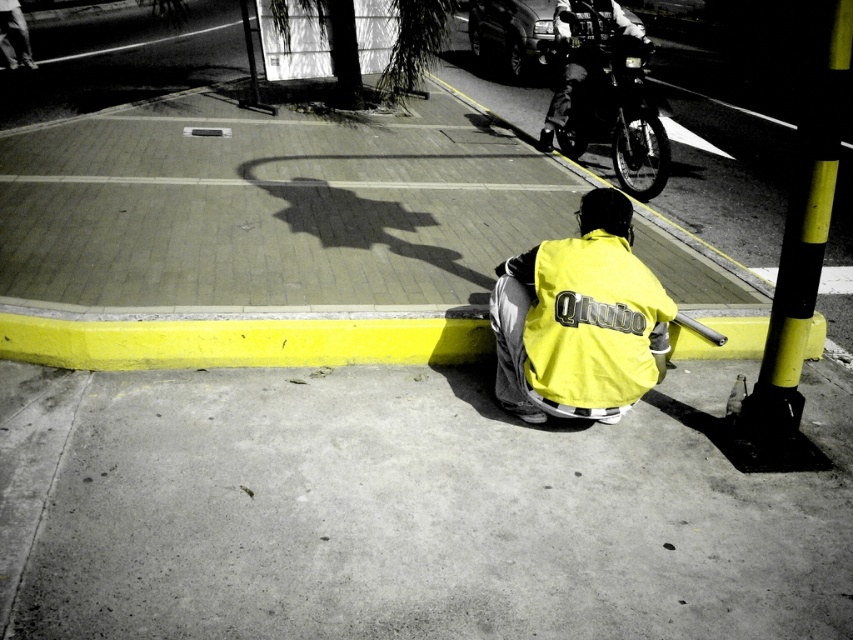
You are a pedestrian crossing the street and see the gray concrete pavement at lower center and the yellow matte safety vest at lower center. Which object is closer to the left edge of the road?

The gray concrete pavement at lower center is positioned on the left side of yellow matte safety vest at lower center, so it is closer to the left edge of the road.

You are a delivery driver who needs to park your vehicle on the street. The parking regulations state that vehicles must be parked at least 1 meter away from any object taller than the curb. Based on the scene, can you park closer to the yellow painted curb at lower center than the yellow matte safety vest at lower center?

The yellow painted curb at lower center has a lesser height compared to the yellow matte safety vest at lower center. Since the safety vest is taller than the curb, you must park at least 1 meter away from it. However, the curb itself is shorter, so you can park closer to the yellow painted curb at lower center as long as you maintain the required distance from the taller safety vest.

You are a delivery robot navigating a narrow path at night. You must pass between the gray concrete pavement at lower center and the yellow matte safety vest at lower center. Can your 1.2 meter wide base fit through the space between them?

The gray concrete pavement at lower center is wider than the yellow matte safety vest at lower center. Since the pavement is wider, the space between them may accommodate the robot. However, the exact width isnanot provided, so it is uncertain if the 1.2 meter width will fit. Further measurement is needed.